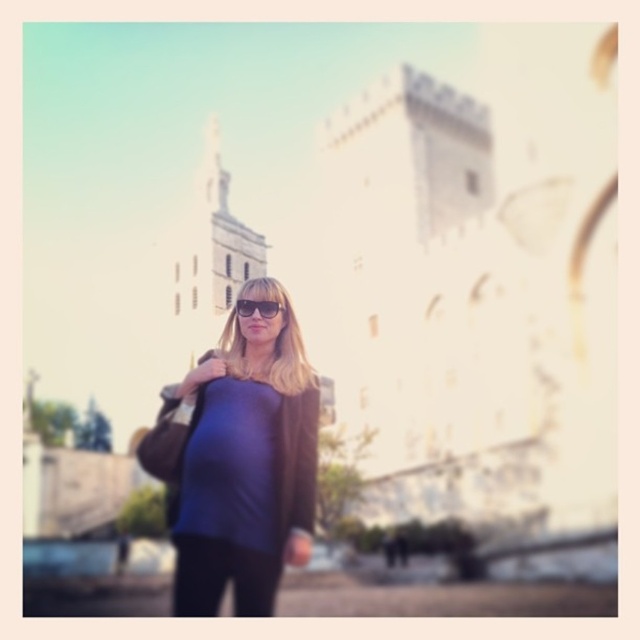
Is matte blue shirt at center to the right of matte black sunglasses at center from the viewer's perspective?

No, matte blue shirt at center is not to the right of matte black sunglasses at center.

Can you confirm if matte blue shirt at center is shorter than matte black sunglasses at center?

No, matte blue shirt at center is not shorter than matte black sunglasses at center.

The width and height of the screenshot is (640, 640). What do you see at coordinates (240, 460) in the screenshot? I see `matte blue shirt at center` at bounding box center [240, 460].

This screenshot has width=640, height=640. In order to click on matte blue shirt at center in this screenshot , I will do `click(240, 460)`.